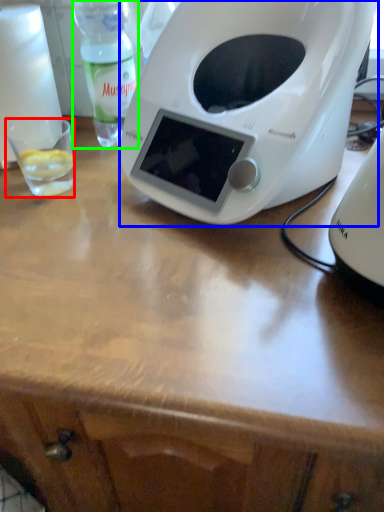
Question: Based on their relative distances, which object is farther from coffee cup (highlighted by a red box)? Choose from toaster (highlighted by a blue box) and bottle (highlighted by a green box).

Choices:
 (A) toaster
 (B) bottle

Answer: (A)